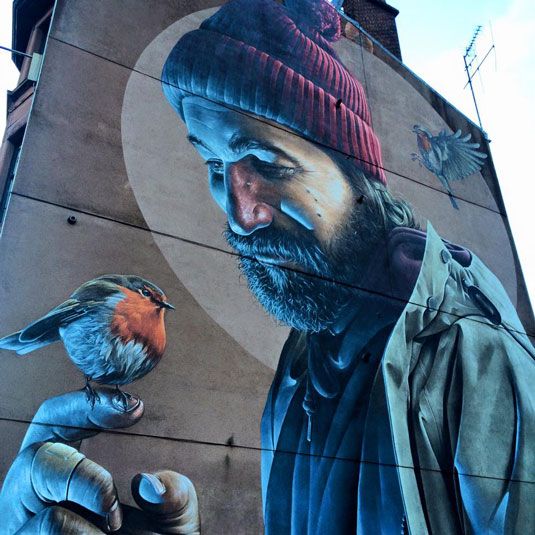
Locate an element on the screen. mural is located at coordinates (232, 258).